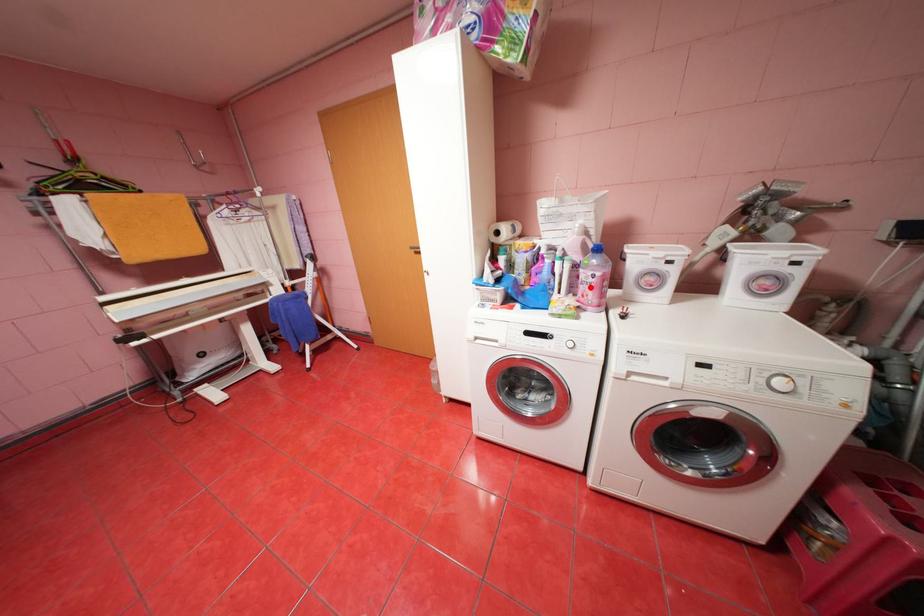
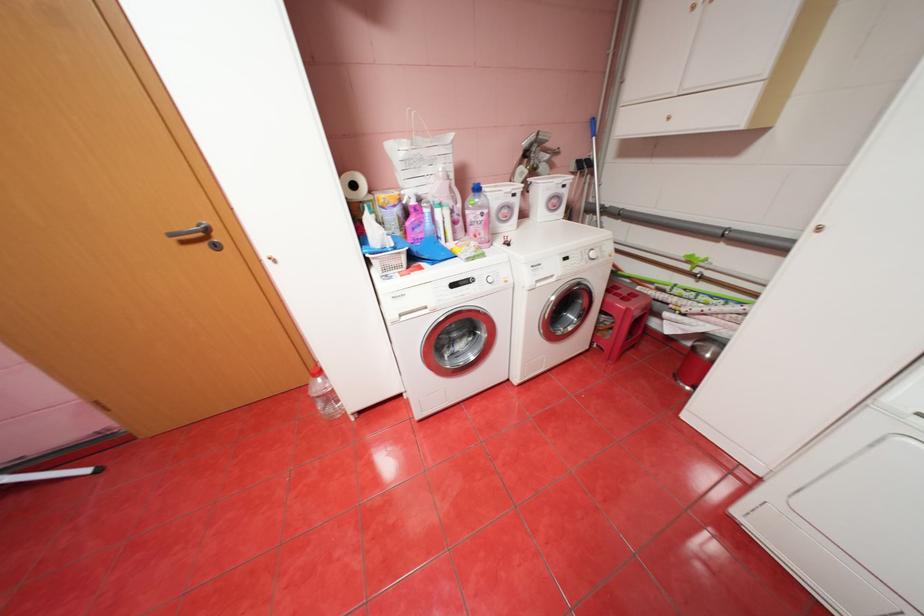
Locate, in the second image, the point that corresponds to the highlighted location in the first image.

(480, 228)